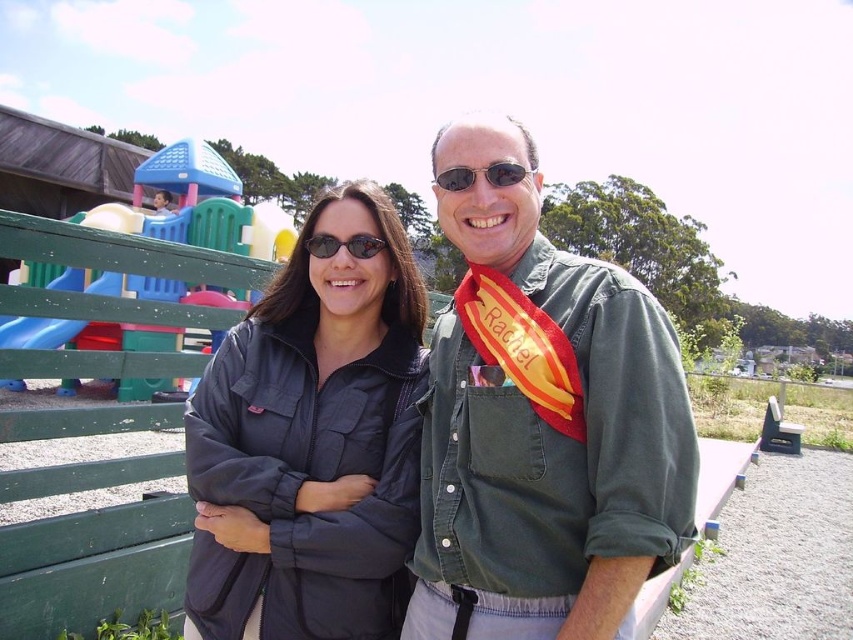
Can you confirm if sunglasses at center is wider than black plastic sunglasses at center?

Incorrect, sunglasses at center's width does not surpass black plastic sunglasses at center's.

Which is behind, point (496, 170) or point (364, 236)?

Positioned behind is point (364, 236).

At what (x,y) coordinates should I click in order to perform the action: click on sunglasses at center. Please return your answer as a coordinate pair (x, y). This screenshot has height=640, width=853. Looking at the image, I should click on coord(483,176).

Find the location of a particular element. The width and height of the screenshot is (853, 640). sunglasses at center is located at coordinates (483, 176).

Is matte black jacket at center positioned before black plastic sunglasses at center?

That is True.

In the scene shown: Can you confirm if matte black jacket at center is thinner than black plastic sunglasses at center?

No.

What do you see at coordinates (311, 444) in the screenshot?
I see `matte black jacket at center` at bounding box center [311, 444].

Identify the location of matte black jacket at center. (311, 444).

Which of these two, green denim shirt at center or sunglasses at center, stands shorter?

sunglasses at center is shorter.

Find the location of a particular element. green denim shirt at center is located at coordinates (543, 422).